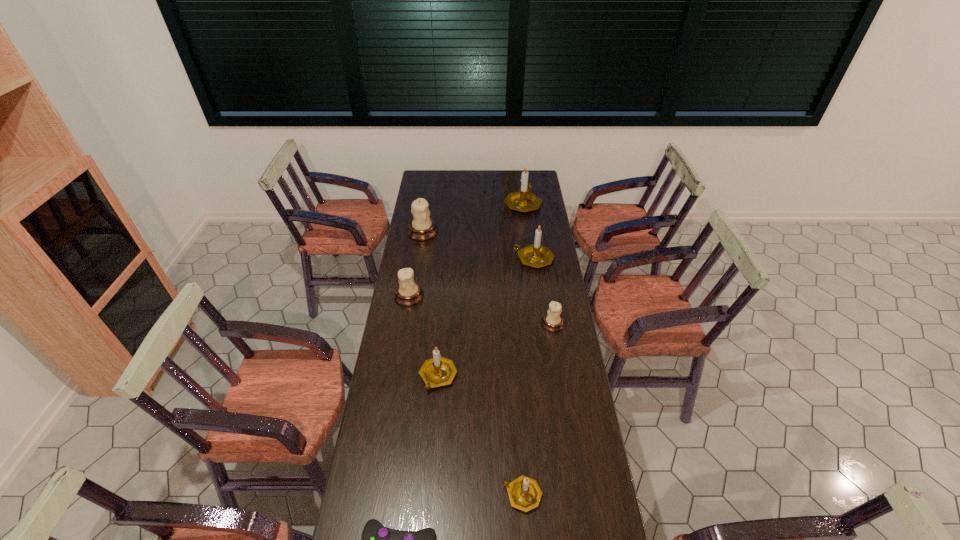
Find the location of `vacant space located 0.300m on the left of the nearest candle holder`. vacant space located 0.300m on the left of the nearest candle holder is located at coordinates coord(405,495).

Locate an element on the screen. vacant space at the left edge is located at coordinates (404, 390).

This screenshot has width=960, height=540. In the image, there is a desktop. Find the location of `vacant space at the right edge`. vacant space at the right edge is located at coordinates (522, 216).

This screenshot has height=540, width=960. What are the coordinates of `blank area at the far right corner` in the screenshot? It's located at (535, 178).

I want to click on empty space between the third smallest gold candle holder and the second nearest white candle holder, so click(x=471, y=278).

Image resolution: width=960 pixels, height=540 pixels. What are the coordinates of `free space that is in between the smallest gold candle holder and the fifth nearest object` in the screenshot? It's located at (466, 396).

Image resolution: width=960 pixels, height=540 pixels. Identify the location of free space between the third nearest gold candle holder and the smallest white candle holder. (543, 292).

I want to click on empty space between the nearest candle holder and the leftmost gold candle holder, so (x=480, y=436).

Find the location of a particular element. vacant area between the nearest white candle holder and the farthest white candle holder is located at coordinates (488, 278).

Locate an element on the screen. Image resolution: width=960 pixels, height=540 pixels. vacant space that is in between the fifth nearest object and the farthest gold candle holder is located at coordinates (466, 251).